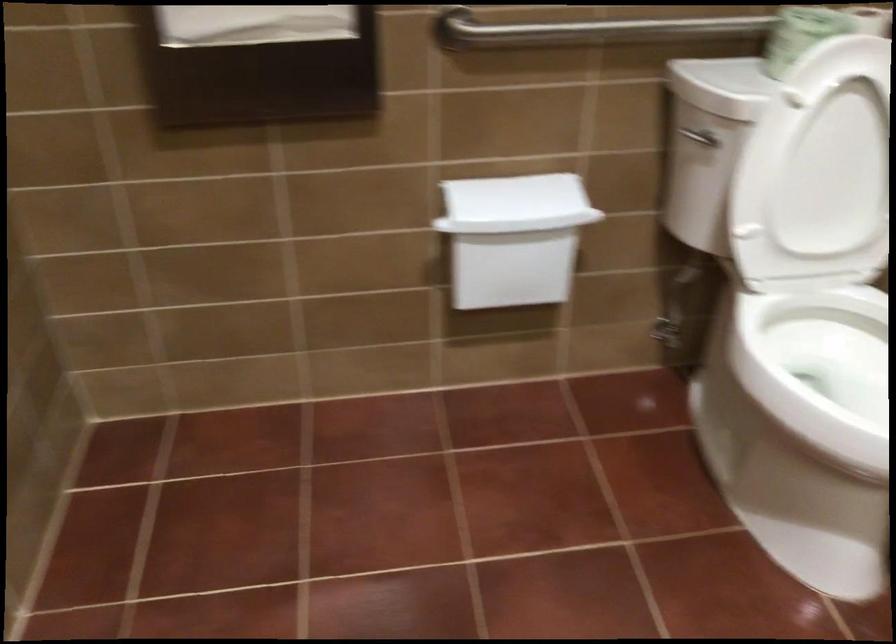
In order to click on metal grab bar in this screenshot , I will do `click(586, 31)`.